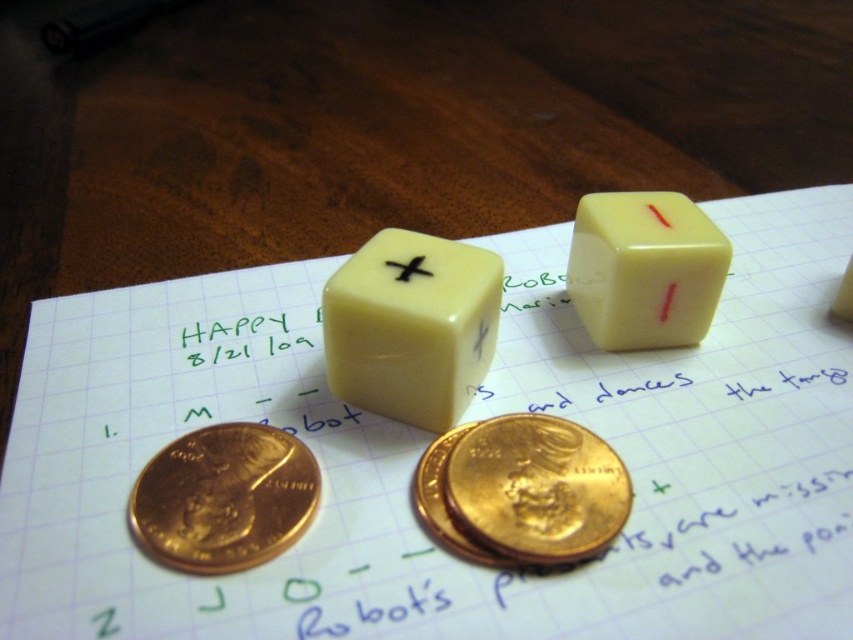
Which is above, gold metallic penny at lower left or yellow matte dice at center?

Positioned higher is yellow matte dice at center.

Does gold metallic penny at lower left have a lesser height compared to yellow matte dice at center?

Correct, gold metallic penny at lower left is not as tall as yellow matte dice at center.

Does point (230, 572) come closer to viewer compared to point (605, 240)?

Yes, point (230, 572) is in front of point (605, 240).

Locate an element on the screen. Image resolution: width=853 pixels, height=640 pixels. gold metallic penny at lower left is located at coordinates (223, 499).

Who is shorter, matte yellow die at center or gold metallic coin at center?

With less height is gold metallic coin at center.

Which is below, matte yellow die at center or gold metallic coin at center?

gold metallic coin at center is below.

Is point (428, 340) positioned in front of point (581, 472)?

That is False.

At what (x,y) coordinates should I click in order to perform the action: click on matte yellow die at center. Please return your answer as a coordinate pair (x, y). This screenshot has width=853, height=640. Looking at the image, I should click on (409, 326).

From the picture: Is gold metallic coin at center wider than black matte x at center?

Correct, the width of gold metallic coin at center exceeds that of black matte x at center.

Can you confirm if gold metallic coin at center is thinner than black matte x at center?

In fact, gold metallic coin at center might be wider than black matte x at center.

The width and height of the screenshot is (853, 640). Identify the location of gold metallic coin at center. (521, 492).